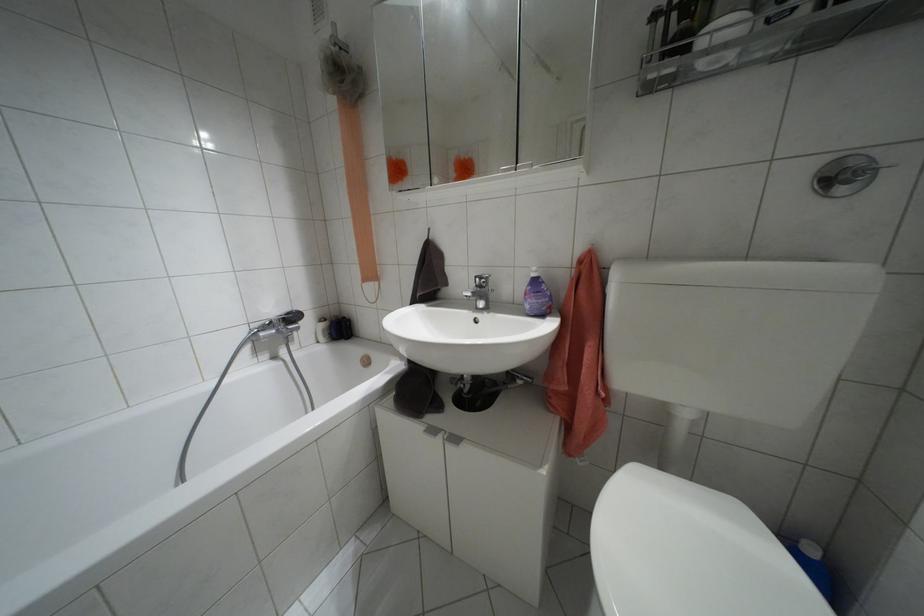
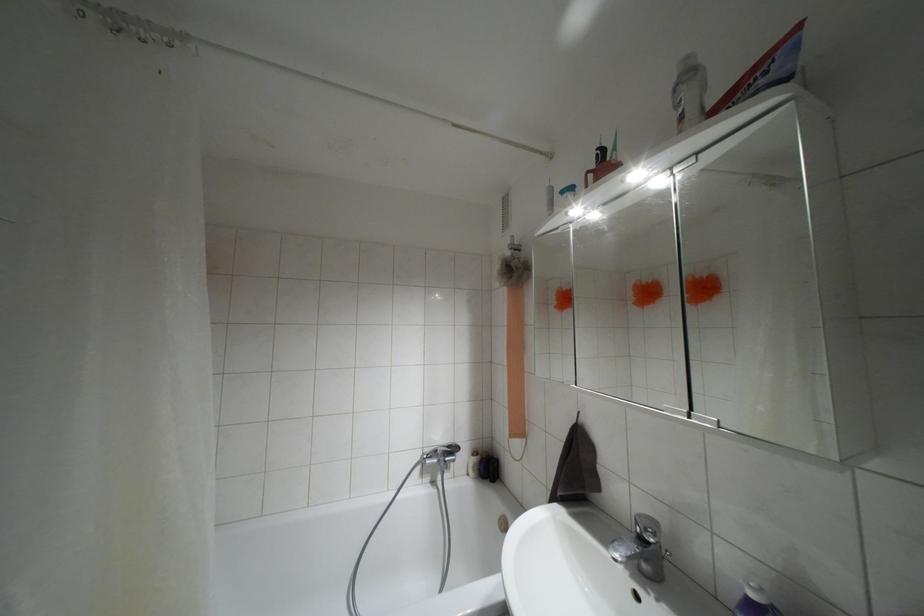
Where in the second image is the point corresponding to point (479, 286) from the first image?

(641, 538)